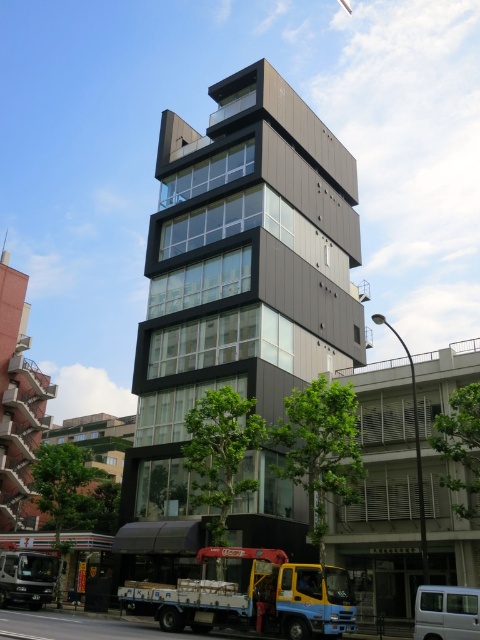
Does yellow metallic truck at lower center have a smaller size compared to yellow metallic truck at lower left?

No, yellow metallic truck at lower center is not smaller than yellow metallic truck at lower left.

Is point (346, 572) closer to camera compared to point (28, 564)?

That is True.

The image size is (480, 640). Identify the location of yellow metallic truck at lower center. (252, 596).

Where is `yellow metallic truck at lower center`? yellow metallic truck at lower center is located at coordinates (252, 596).